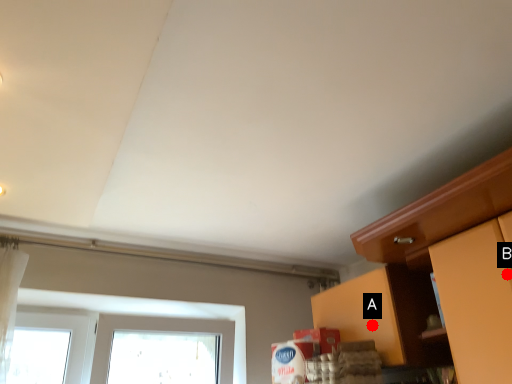
Question: Two points are circled on the image, labeled by A and B beside each circle. Which point appears closest to the camera in this image?

Choices:
 (A) A is closer
 (B) B is closer

Answer: (B)